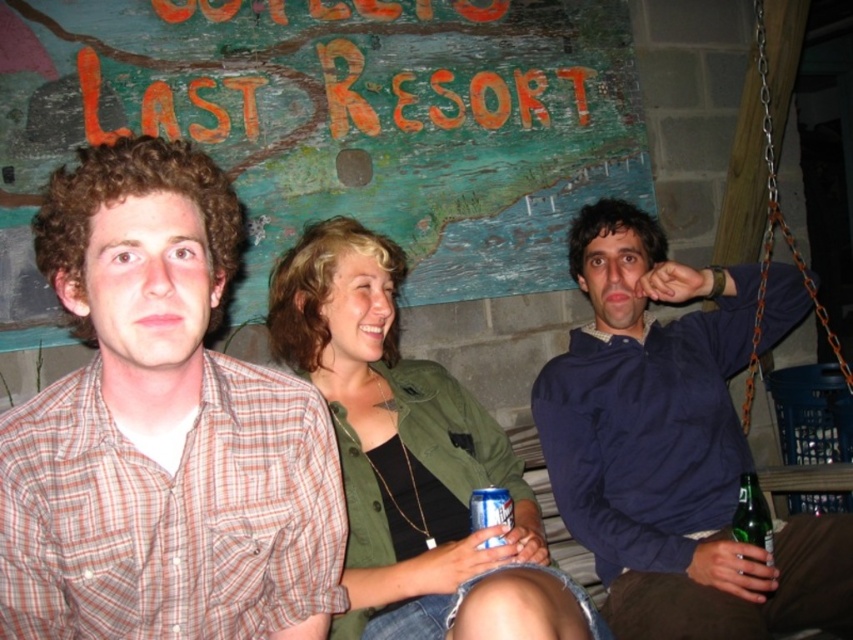
Question: Is plaid cotton shirt at left above green glass bottle at lower right?

Choices:
 (A) yes
 (B) no

Answer: (A)

Question: Is blue cotton shirt at right thinner than blue metallic can at center?

Choices:
 (A) no
 (B) yes

Answer: (A)

Question: Is plaid cotton shirt at left thinner than blue metallic can at center?

Choices:
 (A) yes
 (B) no

Answer: (B)

Question: Which object appears closest to the camera in this image?

Choices:
 (A) plaid cotton shirt at left
 (B) blue metallic can at center

Answer: (A)

Question: Which point is farther to the camera?

Choices:
 (A) (735, 288)
 (B) (309, 554)
 (C) (397, 314)

Answer: (C)

Question: Which point is closer to the camera taking this photo?

Choices:
 (A) (456, 413)
 (B) (498, 497)
 (C) (759, 499)

Answer: (B)